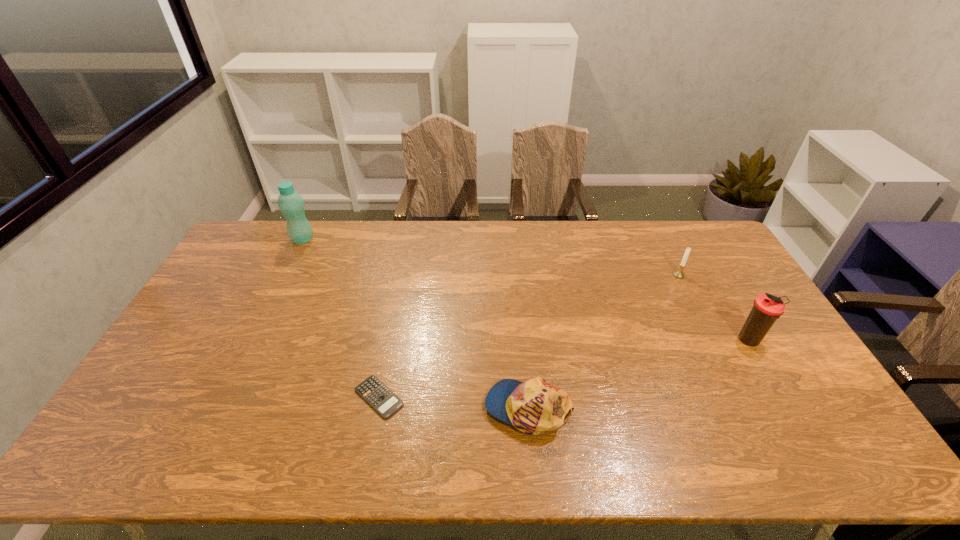
The width and height of the screenshot is (960, 540). Identify the location of the tallest object. (291, 204).

The height and width of the screenshot is (540, 960). I want to click on bottle, so click(x=291, y=204).

I want to click on the third farthest object, so click(767, 308).

Image resolution: width=960 pixels, height=540 pixels. Find the location of `thermos bottle`. thermos bottle is located at coordinates (767, 308).

This screenshot has width=960, height=540. Identify the location of the third tallest object. (679, 273).

You are a GUI agent. You are given a task and a screenshot of the screen. Output one action in this format:
    pyautogui.click(x=<x>, y=<y>)
    Task: Click on the second farthest object
    This screenshot has width=960, height=540.
    Given the screenshot: What is the action you would take?
    pyautogui.click(x=679, y=273)

Where is `cap`? The width and height of the screenshot is (960, 540). cap is located at coordinates (535, 406).

Identify the location of the third object from left to right. (535, 406).

Locate an element on the screen. The width and height of the screenshot is (960, 540). calculator is located at coordinates (386, 403).

Locate an element on the screen. This screenshot has height=540, width=960. the shortest object is located at coordinates (386, 403).